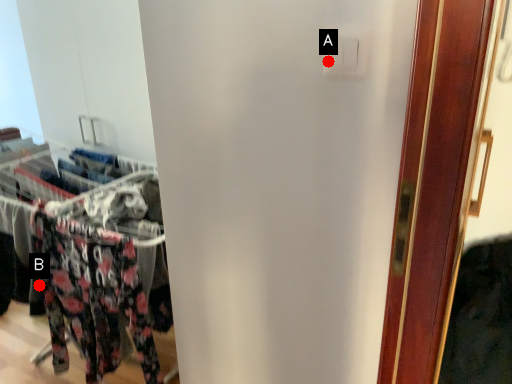
Question: Two points are circled on the image, labeled by A and B beside each circle. Which point is closer to the camera?

Choices:
 (A) A is closer
 (B) B is closer

Answer: (A)